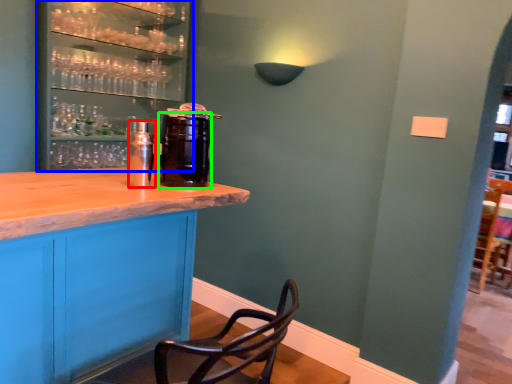
Question: Estimate the real-world distances between objects in this image. Which object is farther from beverage (highlighted by a red box), shelf (highlighted by a blue box) or beverage (highlighted by a green box)?

Choices:
 (A) shelf
 (B) beverage

Answer: (A)